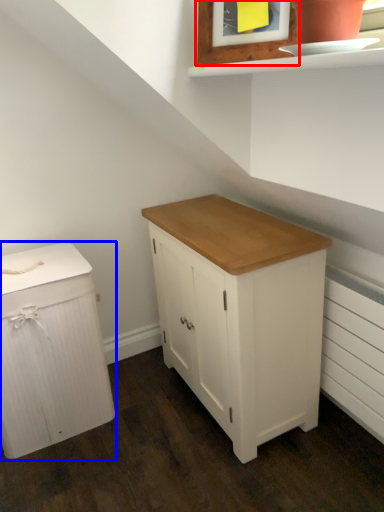
Question: Which of the following is the farthest to the observer, picture frame (highlighted by a red box) or chest of drawers (highlighted by a blue box)?

Choices:
 (A) picture frame
 (B) chest of drawers

Answer: (B)